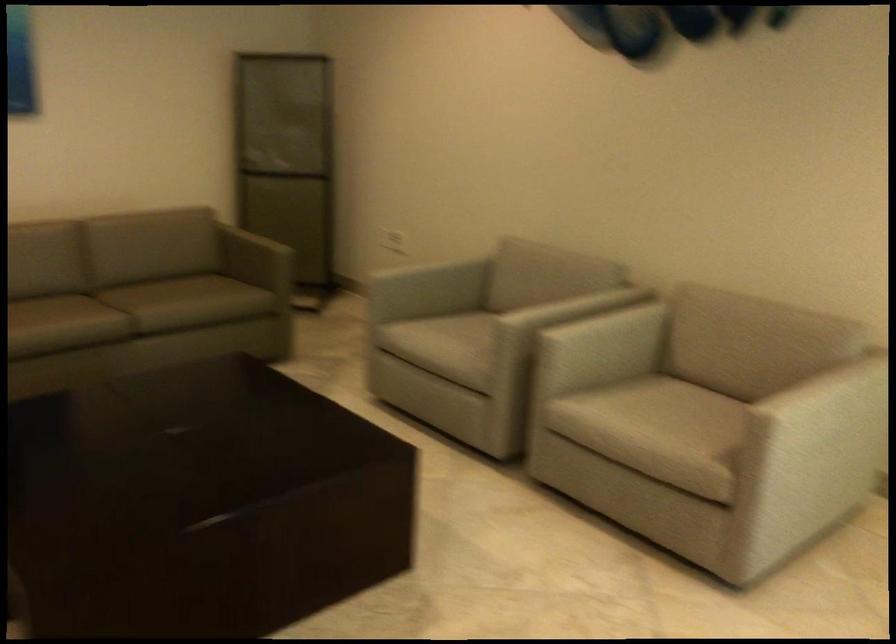
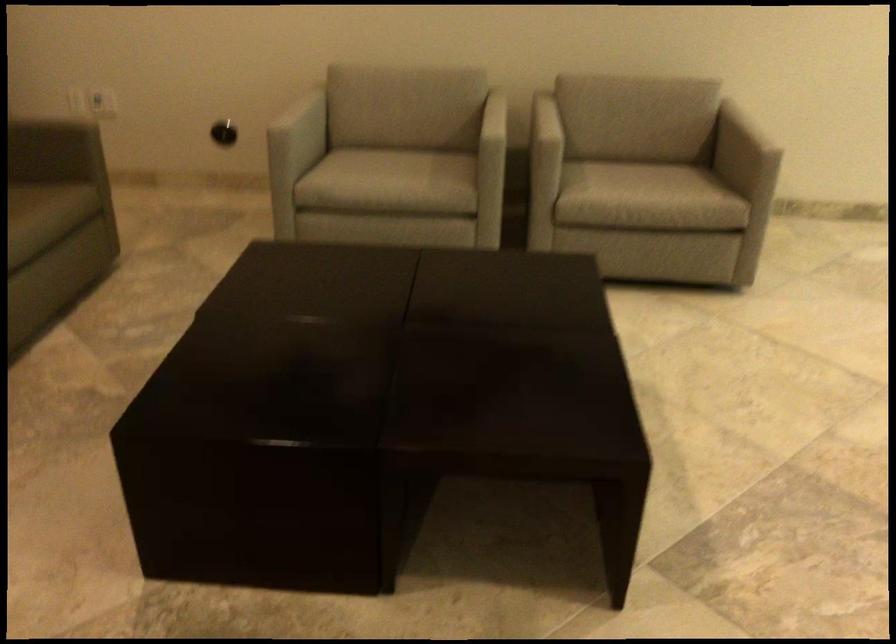
Question: I am providing you with two images of the same scene from different viewpoints. Which of the following objects are not visible in image2?

Choices:
 (A) light gray chair armrest
 (B) sofa sitting surface
 (C) light gray chair sitting surface
 (D) none of these

Answer: (D)